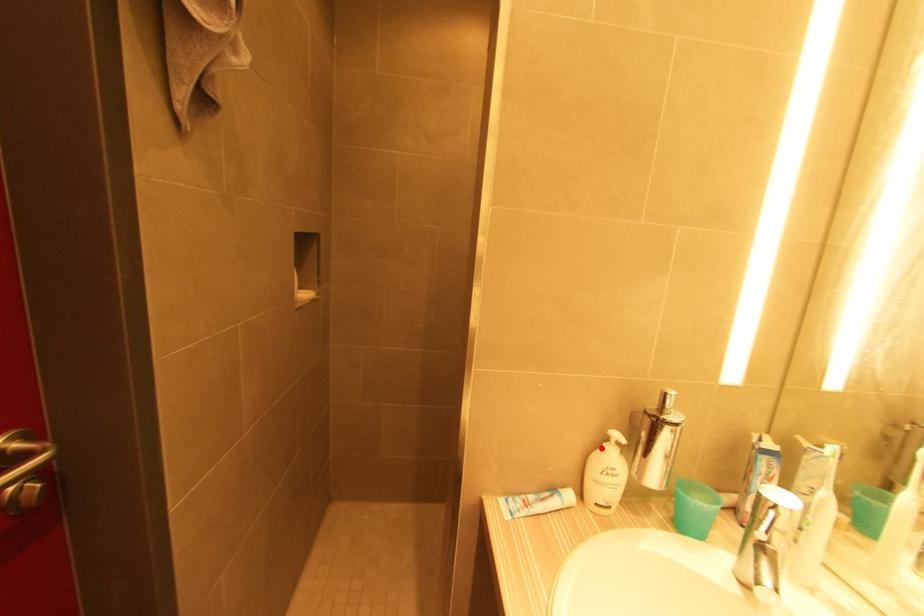
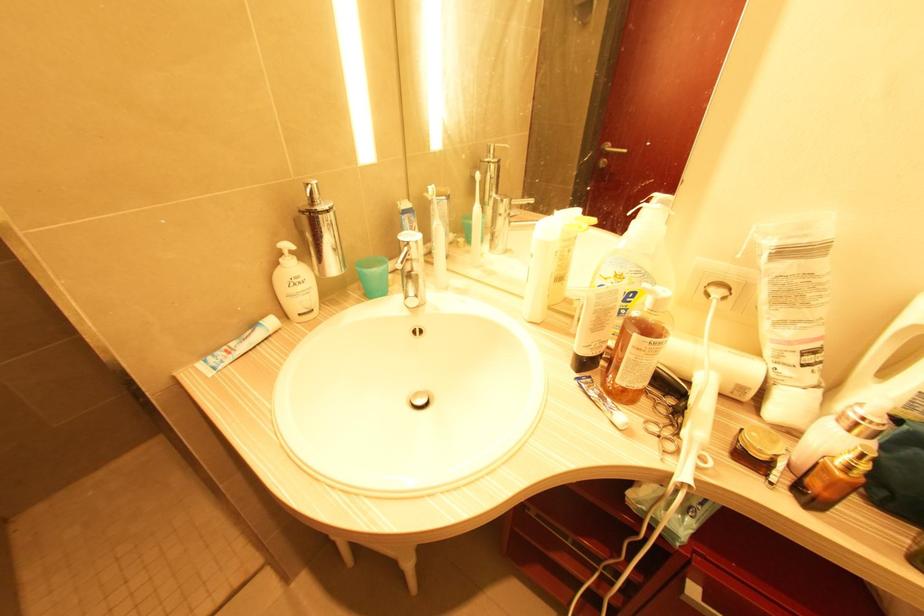
In the second image, find the point that corresponds to the highlighted location in the first image.

(280, 265)